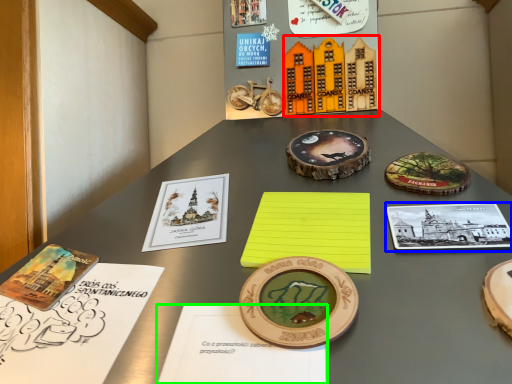
Question: Which object is the closest to the toy (highlighted by a red box)? Choose among these: book (highlighted by a blue box) or notebook (highlighted by a green box).

Choices:
 (A) book
 (B) notebook

Answer: (A)